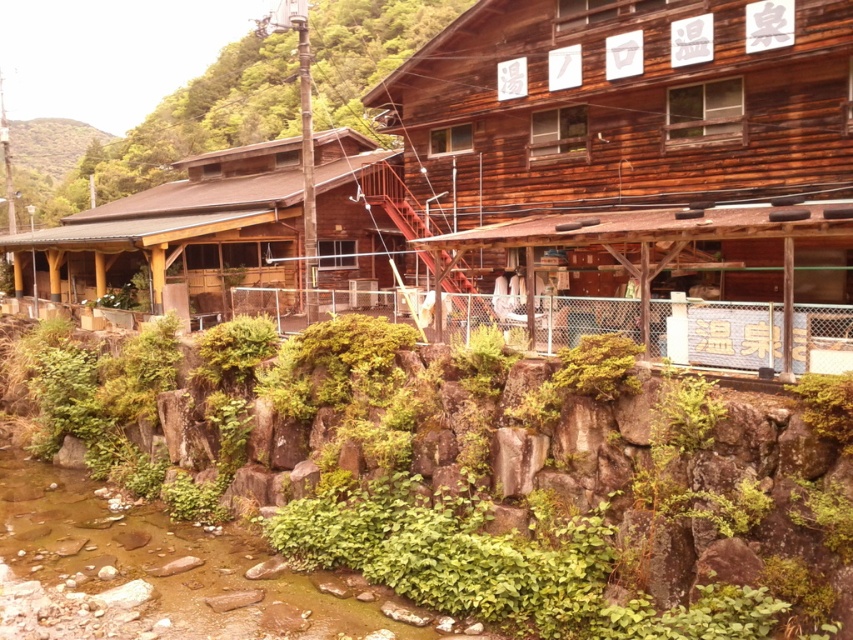
You are standing in front of the rustic wooden building and want to place a small potted plant between the green mossy rock at lower center and the brown wooden hut at center. Based on their positions, which object should the potted plant be closer to?

The green mossy rock at lower center is positioned on the right side of brown wooden hut at center, so the potted plant should be placed closer to the brown wooden hut at center to be between them.

From the picture: You are a tourist standing in front of the rustic wooden building. You see a green mossy rock at lower center and a brown wooden hut at center. Which object is nearer to you?

The green mossy rock at lower center is closer to the viewer than the brown wooden hut at center, so the green mossy rock at lower center is nearer to you.

You are standing in front of the rustic wooden building and want to walk from the green leafy shrubs at center to the green mossy rock at lower center. Which direction should you move?

You should move to the right to reach the green mossy rock at lower center from the green leafy shrubs at center since the green mossy rock at lower center is positioned to the right of the shrubs.